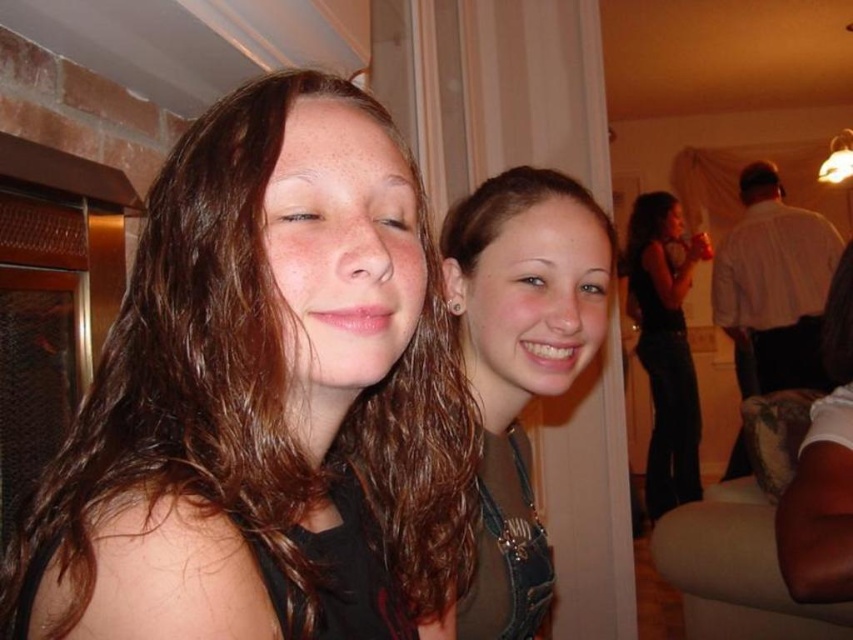
You are a photographer trying to capture the perfect shot of the scene. You need to position your camera at a specific coordinate to ensure the brown shiny hair at center is centered in the frame. What coordinate should you aim for?

The brown shiny hair at center is located at point (265,401), so you should aim your camera at that coordinate to center it in the frame.

You are taking a photo of two people at a social gathering. The first person is at point (x=744, y=257) and the second is at point (x=674, y=365). If you want to focus on the person closer to the camera, which point should you focus on?

Point (x=674, y=365) is closer to the camera than point (x=744, y=257), so you should focus on point (x=674, y=365) to capture the person closer to the camera.